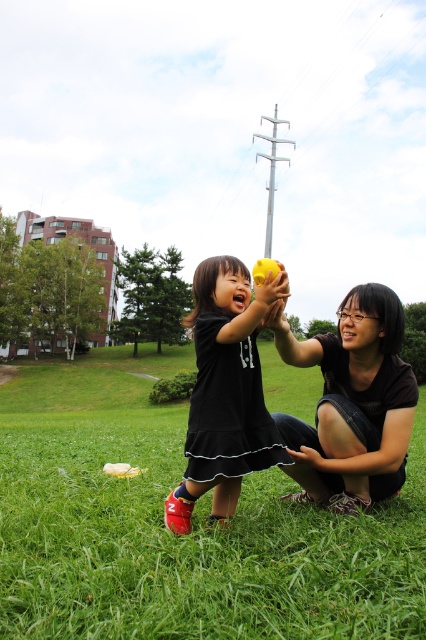
Can you confirm if green grass at center is positioned above matte yellow ball at center?

Incorrect, green grass at center is not positioned above matte yellow ball at center.

Is green grass at center positioned behind matte yellow ball at center?

No, it is not.

The height and width of the screenshot is (640, 426). Find the location of `green grass at center`. green grass at center is located at coordinates (181, 536).

Is matte black shirt at center closer to camera compared to matte yellow ball at center?

No.

Is the position of matte black shirt at center more distant than that of matte yellow ball at center?

That is True.

Does point (380, 474) lie behind point (226, 396)?

Yes.

Find the location of a particular element. Image resolution: width=426 pixels, height=640 pixels. matte black shirt at center is located at coordinates (351, 401).

Looking at this image, does green grass at center appear under matte black shirt at center?

Yes, green grass at center is below matte black shirt at center.

Which is more to the left, green grass at center or matte black shirt at center?

Positioned to the left is matte black shirt at center.

You are a GUI agent. You are given a task and a screenshot of the screen. Output one action in this format:
    pyautogui.click(x=<x>, y=<y>)
    Task: Click on the green grass at center
    The image size is (426, 640).
    Given the screenshot: What is the action you would take?
    (x=181, y=536)

Find the location of a particular element. green grass at center is located at coordinates (181, 536).